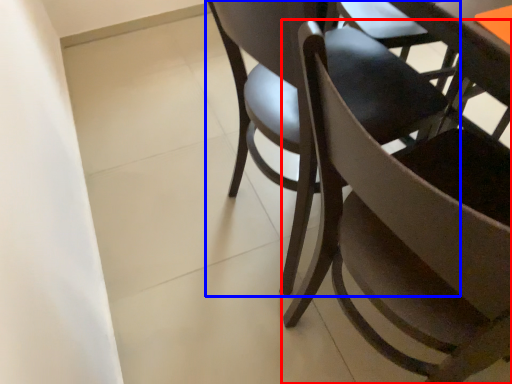
Question: Among these objects, which one is nearest to the camera, chair (highlighted by a red box) or chair (highlighted by a blue box)?

Choices:
 (A) chair
 (B) chair

Answer: (A)